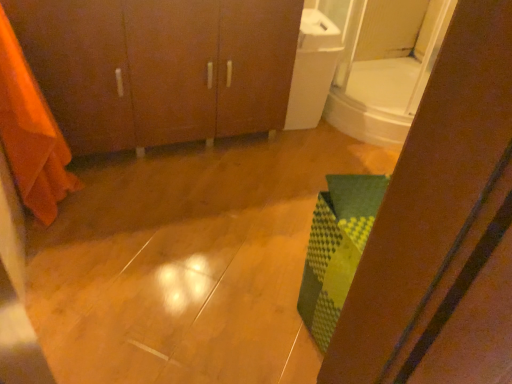
Describe the element at coordinates (31, 133) in the screenshot. I see `orange fabric at left` at that location.

Locate an element on the screen. Image resolution: width=512 pixels, height=384 pixels. matte wood cabinet at upper left is located at coordinates (159, 67).

Based on the photo, is matte wood cabinet at upper left located within orange fabric at left?

No, matte wood cabinet at upper left is located outside of orange fabric at left.

Where is `bathroom cabinet above the orange fabric at left (from the image's perspective)`? The height and width of the screenshot is (384, 512). bathroom cabinet above the orange fabric at left (from the image's perspective) is located at coordinates (159, 67).

Is orange fabric at left taller than matte wood cabinet at upper left?

Indeed, orange fabric at left has a greater height compared to matte wood cabinet at upper left.

How many degrees apart are the facing directions of orange fabric at left and matte wood cabinet at upper left?

89.5 degrees separate the facing orientations of orange fabric at left and matte wood cabinet at upper left.

In the scene shown: Is matte wood cabinet at upper left taller than orange fabric at left?

In fact, matte wood cabinet at upper left may be shorter than orange fabric at left.

In the scene shown: Are matte wood cabinet at upper left and orange fabric at left beside each other?

matte wood cabinet at upper left and orange fabric at left are not in contact.

Consider the image. Which object is positioned more to the right, matte wood cabinet at upper left or orange fabric at left?

matte wood cabinet at upper left is more to the right.

Is matte wood cabinet at upper left facing towards orange fabric at left?

Yes, matte wood cabinet at upper left is facing orange fabric at left.

From a real-world perspective, between white glossy mirror at upper right and matte wood cabinet at upper left, who is vertically higher?

white glossy mirror at upper right.

Is white glossy mirror at upper right located outside matte wood cabinet at upper left?

Yes.

Which of these two, white glossy mirror at upper right or matte wood cabinet at upper left, stands shorter?

white glossy mirror at upper right is shorter.

Would you consider white glossy mirror at upper right to be distant from matte wood cabinet at upper left?

No, there isn't a large distance between white glossy mirror at upper right and matte wood cabinet at upper left.

Is white glossy mirror at upper right surrounded by matte wood cabinet at upper left?

No, white glossy mirror at upper right is not a part of matte wood cabinet at upper left.

From the image's perspective, relative to white glossy mirror at upper right, is matte wood cabinet at upper left above or below?

matte wood cabinet at upper left is below white glossy mirror at upper right.

Does point (296, 21) lie behind point (382, 52)?

No, it is not.

From a real-world perspective, which object rests below the other?

matte wood cabinet at upper left is physically lower.

Who is bigger, white glossy mirror at upper right or orange fabric at left?

white glossy mirror at upper right.

Are white glossy mirror at upper right and orange fabric at left beside each other?

No, white glossy mirror at upper right is not next to orange fabric at left.

Is white glossy mirror at upper right positioned beyond the bounds of orange fabric at left?

Yes.

Is white glossy mirror at upper right wider than orange fabric at left?

Indeed, white glossy mirror at upper right has a greater width compared to orange fabric at left.

Is orange fabric at left further to the viewer compared to white glossy mirror at upper right?

No, orange fabric at left is in front of white glossy mirror at upper right.

From the picture: Considering the sizes of orange fabric at left and white glossy mirror at upper right in the image, is orange fabric at left taller or shorter than white glossy mirror at upper right?

orange fabric at left is taller than white glossy mirror at upper right.

Which is in front, point (9, 143) or point (338, 121)?

The point (9, 143) is more forward.

Is orange fabric at left aimed at white glossy mirror at upper right?

Yes, orange fabric at left faces towards white glossy mirror at upper right.

Where is `shower curtain on the left side of matte wood cabinet at upper left`? The width and height of the screenshot is (512, 384). shower curtain on the left side of matte wood cabinet at upper left is located at coordinates (31, 133).

The width and height of the screenshot is (512, 384). In order to click on bathroom cabinet above the orange fabric at left (from the image's perspective) in this screenshot , I will do `click(159, 67)`.

Based on their spatial positions, is matte wood cabinet at upper left or orange fabric at left further from white glossy mirror at upper right?

Based on the image, orange fabric at left appears to be further to white glossy mirror at upper right.

Which object lies further to the anchor point orange fabric at left, white glossy mirror at upper right or matte wood cabinet at upper left?

white glossy mirror at upper right is positioned further to the anchor orange fabric at left.

Based on their spatial positions, is white glossy mirror at upper right or orange fabric at left closer to matte wood cabinet at upper left?

orange fabric at left lies closer to matte wood cabinet at upper left than the other object.

Which object lies nearer to the anchor point matte wood cabinet at upper left, orange fabric at left or white glossy mirror at upper right?

orange fabric at left is closer to matte wood cabinet at upper left.

Looking at the image, which one is located closer to white glossy mirror at upper right, orange fabric at left or matte wood cabinet at upper left?

Among the two, matte wood cabinet at upper left is located nearer to white glossy mirror at upper right.

Based on their spatial positions, is matte wood cabinet at upper left or white glossy mirror at upper right further from orange fabric at left?

white glossy mirror at upper right is further to orange fabric at left.

Identify the location of bathroom cabinet between orange fabric at left and white glossy mirror at upper right. The image size is (512, 384). (159, 67).